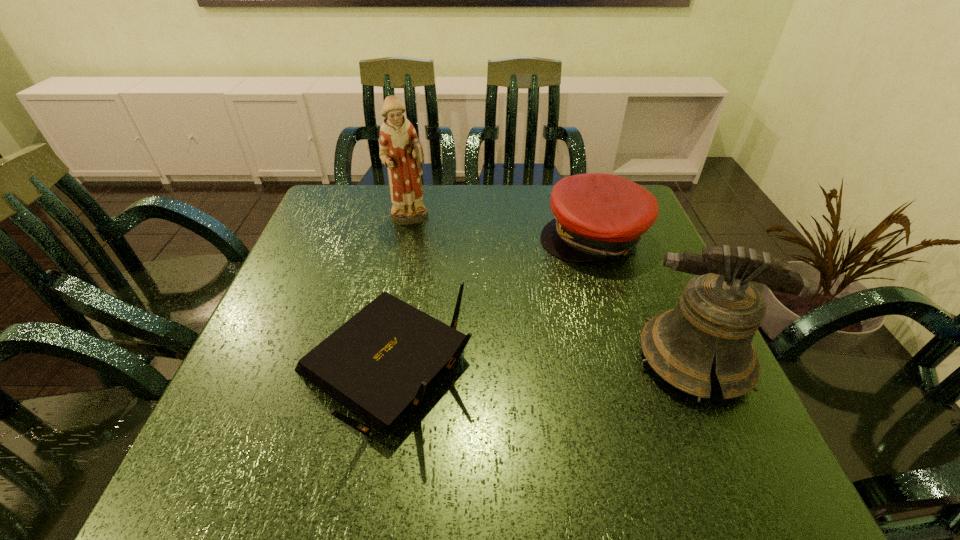
You are a GUI agent. You are given a task and a screenshot of the screen. Output one action in this format:
    pyautogui.click(x=<x>, y=<y>)
    Task: Click on the empty space between the figurine and the cap
    The image size is (960, 540).
    Given the screenshot: What is the action you would take?
    click(502, 228)

Find the location of a particular element. This screenshot has width=960, height=540. vacant space that's between the cap and the figurine is located at coordinates (502, 228).

Identify the location of vacant region between the cap and the router. The image size is (960, 540). (489, 302).

Identify the location of vacant space in between the router and the figurine. This screenshot has width=960, height=540. (397, 293).

What are the coordinates of `vacant region between the router and the tallest object` in the screenshot? It's located at (397, 293).

Find the location of `vacant point located between the third shortest object and the cap`. vacant point located between the third shortest object and the cap is located at coordinates (644, 298).

Locate an element on the screen. Image resolution: width=960 pixels, height=540 pixels. object identified as the third closest to the tallest object is located at coordinates (719, 312).

Choose which object is the nearest neighbor to the router. Please provide its 2D coordinates. Your answer should be formatted as a tuple, i.e. [(x, y)], where the tuple contains the x and y coordinates of a point satisfying the conditions above.

[(596, 215)]

The width and height of the screenshot is (960, 540). I want to click on vacant region that satisfies the following two spatial constraints: 1. on the front side of the figurine; 2. on the left side of the bell, so click(x=381, y=359).

I want to click on free space that satisfies the following two spatial constraints: 1. on the front side of the tallest object; 2. on the right side of the router, so click(x=379, y=368).